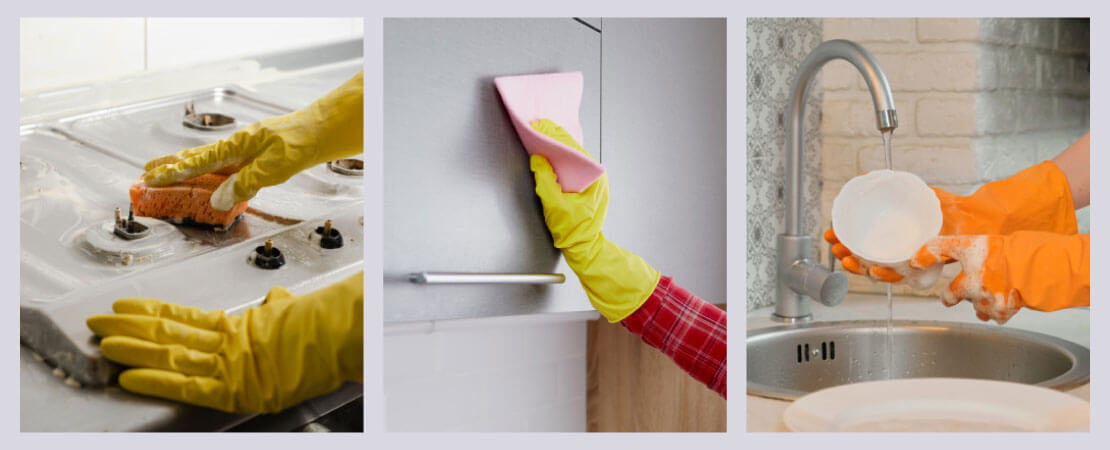
Locate an element on the screen. This screenshot has width=1110, height=450. white wall is located at coordinates (477, 395), (75, 47), (200, 42).